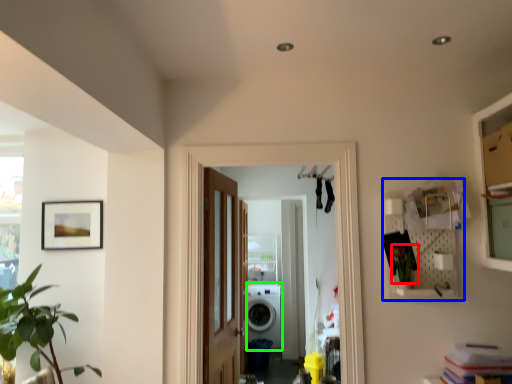
Question: Based on their relative distances, which object is farther from plant (highlighted by a red box)? Choose from shelf (highlighted by a blue box) and washing machine (highlighted by a green box).

Choices:
 (A) shelf
 (B) washing machine

Answer: (B)